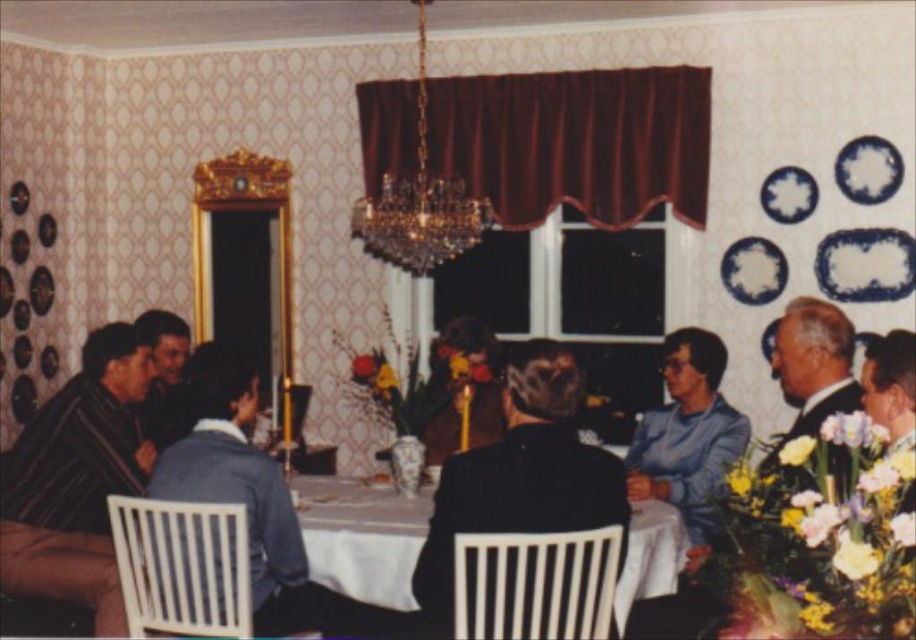
You are a guest at this dinner party and want to place your napkin on the table. Which object is closer to you, the white glossy tablecloth at center or the crystal glass chandelier at upper center?

The white glossy tablecloth at center is closer to you since it is in front of the crystal glass chandelier at upper center.